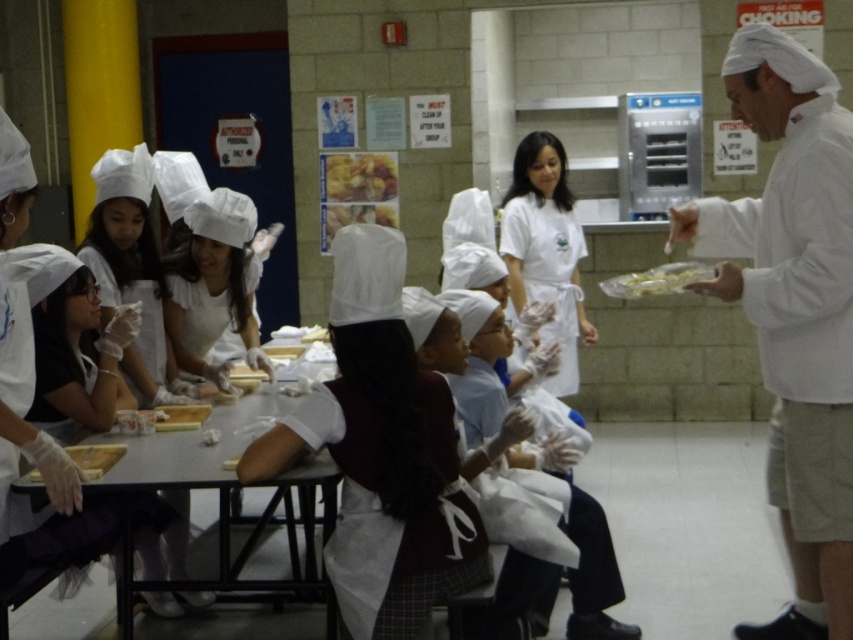
Question: In this image, where is white matte chef hat at right located relative to golden brown crumbly pastry at center?

Choices:
 (A) right
 (B) left

Answer: (A)

Question: Considering the real-world distances, which object is farthest from the yellow matte pasta at center?

Choices:
 (A) smooth white table at center
 (B) white matte chef hat at right

Answer: (A)

Question: Estimate the real-world distances between objects in this image. Which object is closer to the white matte chef hat at right?

Choices:
 (A) smooth white table at center
 (B) yellow matte pasta at center

Answer: (B)

Question: Which point appears farthest from the camera in this image?

Choices:
 (A) (337, 182)
 (B) (329, 465)

Answer: (A)

Question: From the image, what is the correct spatial relationship of white matte chef hat at right in relation to yellow matte pasta at center?

Choices:
 (A) left
 (B) right

Answer: (B)

Question: Is white matte chef hat at right closer to the viewer compared to golden brown crumbly pastry at center?

Choices:
 (A) yes
 (B) no

Answer: (A)